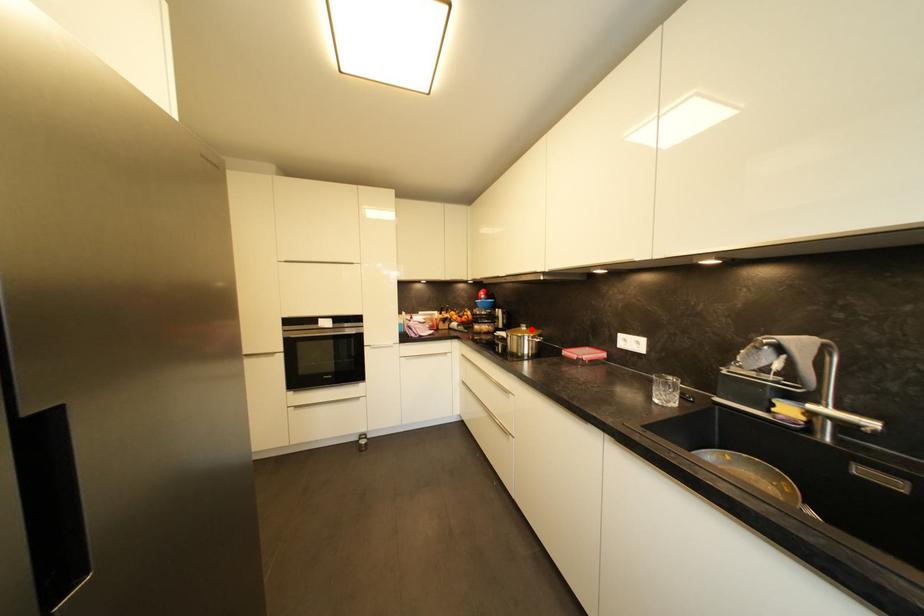
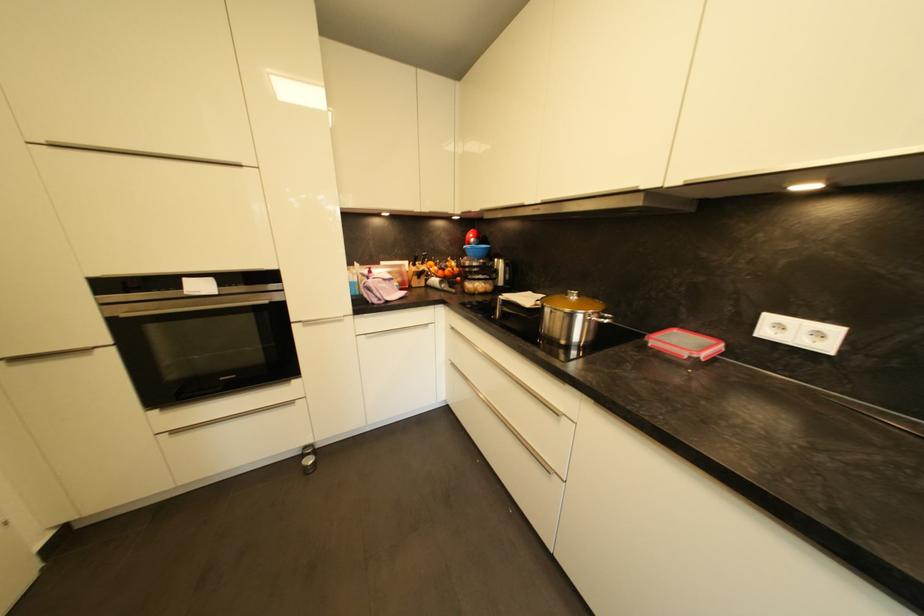
Find the pixel in the second image that matches the highlighted location in the first image.

(584, 298)